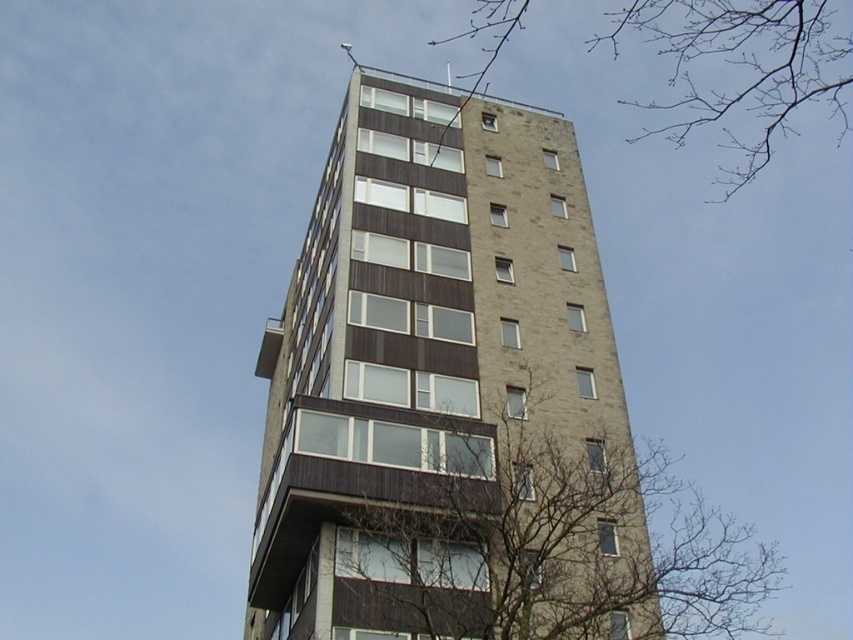
Does brown brick building at center have a greater height compared to brown leafless branches at lower center?

No.

Which is in front, point (444, 461) or point (428, 611)?

Positioned in front is point (428, 611).

Between point (460, 384) and point (381, 436), which one is positioned in front?

Positioned in front is point (381, 436).

Where is `brown brick building at center`? The height and width of the screenshot is (640, 853). brown brick building at center is located at coordinates (445, 392).

Between brown leafless branches at lower center and bare branches at upper center, which one appears on the right side from the viewer's perspective?

Positioned to the right is bare branches at upper center.

Who is shorter, brown leafless branches at lower center or bare branches at upper center?

bare branches at upper center

Identify the location of brown leafless branches at lower center. The width and height of the screenshot is (853, 640). (543, 541).

Who is taller, brown brick building at center or bare branches at upper center?

bare branches at upper center is taller.

Measure the distance from brown brick building at center to bare branches at upper center.

brown brick building at center is 190.61 meters away from bare branches at upper center.

Is point (347, 150) less distant than point (686, 116)?

That is True.

What are the coordinates of `brown brick building at center` in the screenshot? It's located at (445, 392).